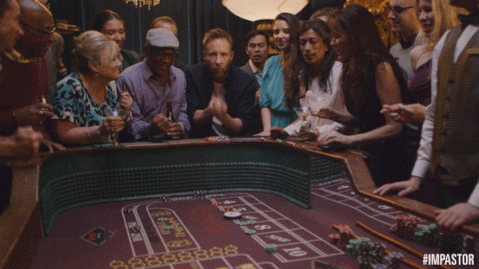
Locate an element on the screen. The height and width of the screenshot is (269, 479). craps table is located at coordinates (243, 259).